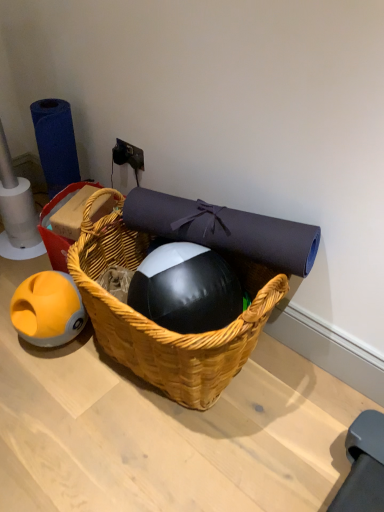
Question: Can you confirm if blue matte roll of toilet paper at left is thinner than woven wood basket at center?

Choices:
 (A) yes
 (B) no

Answer: (A)

Question: Considering the relative sizes of blue matte roll of toilet paper at left and woven wood basket at center in the image provided, is blue matte roll of toilet paper at left smaller than woven wood basket at center?

Choices:
 (A) no
 (B) yes

Answer: (A)

Question: From a real-world perspective, is blue matte roll of toilet paper at left positioned over woven wood basket at center based on gravity?

Choices:
 (A) yes
 (B) no

Answer: (A)

Question: Is blue matte roll of toilet paper at left at the left side of woven wood basket at center?

Choices:
 (A) yes
 (B) no

Answer: (A)

Question: Is woven wood basket at center at the back of blue matte roll of toilet paper at left?

Choices:
 (A) no
 (B) yes

Answer: (A)

Question: Considering their positions, is blue matte roll of toilet paper at left located in front of or behind woven wood basket at center?

Choices:
 (A) behind
 (B) front

Answer: (A)

Question: From their relative heights in the image, would you say blue matte roll of toilet paper at left is taller or shorter than woven wood basket at center?

Choices:
 (A) short
 (B) tall

Answer: (B)

Question: From the image's perspective, is blue matte roll of toilet paper at left located above or below woven wood basket at center?

Choices:
 (A) below
 (B) above

Answer: (B)

Question: Choose the correct answer: Is blue matte roll of toilet paper at left inside woven wood basket at center or outside it?

Choices:
 (A) outside
 (B) inside

Answer: (A)

Question: From their relative heights in the image, would you say blue matte roll of toilet paper at left is taller or shorter than woven wood picnic basket at center?

Choices:
 (A) short
 (B) tall

Answer: (A)

Question: Considering the positions of point (59, 177) and point (140, 330), is point (59, 177) closer or farther from the camera than point (140, 330)?

Choices:
 (A) farther
 (B) closer

Answer: (A)

Question: From a real-world perspective, is blue matte roll of toilet paper at left physically located above or below woven wood picnic basket at center?

Choices:
 (A) below
 (B) above

Answer: (B)

Question: From the image's perspective, is blue matte roll of toilet paper at left located above or below woven wood picnic basket at center?

Choices:
 (A) above
 (B) below

Answer: (A)

Question: Does point (51, 214) appear closer or farther from the camera than point (46, 125)?

Choices:
 (A) closer
 (B) farther

Answer: (A)

Question: From the image's perspective, is woven wood basket at center positioned above or below blue matte roll of toilet paper at left?

Choices:
 (A) above
 (B) below

Answer: (B)